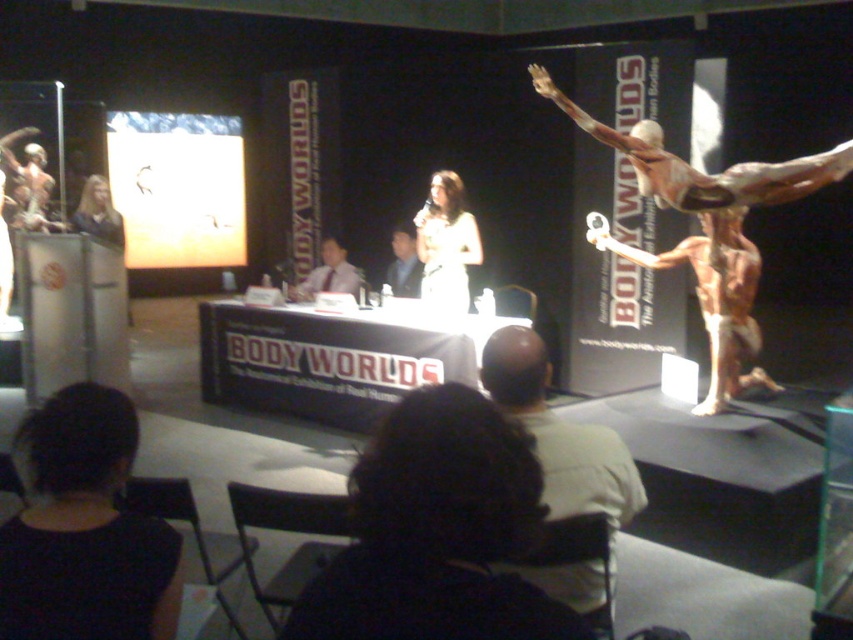
Looking at this image, you are an attendee at the BODY WORLDS event and you want to take a photo of the speaker. The speaker is standing at the podium on the left side of the stage. You notice two objects in your camera viewfinder. One is the black fabric hair at lower left and the other is the light green shirt at center. Which object should you focus on to capture the speaker clearly?

The light green shirt at center is the speaker, so you should focus on the light green shirt at center to capture the speaker clearly.

You are standing at the front row of the audience looking towards the stage. There are two points marked on the stage, one at coordinate point (67,552) and another at point (334,243). Which point is closer to you?

Point (67,552) is closer to the camera than point (334,243), so the point at (67,552) is closer to you.